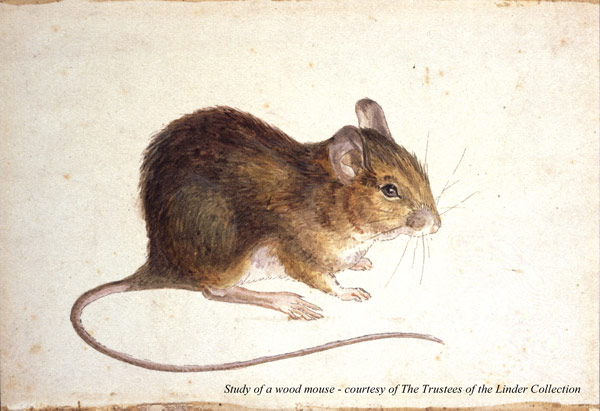
The image size is (600, 411). Find the location of `brown trim`. brown trim is located at coordinates (553, 401).